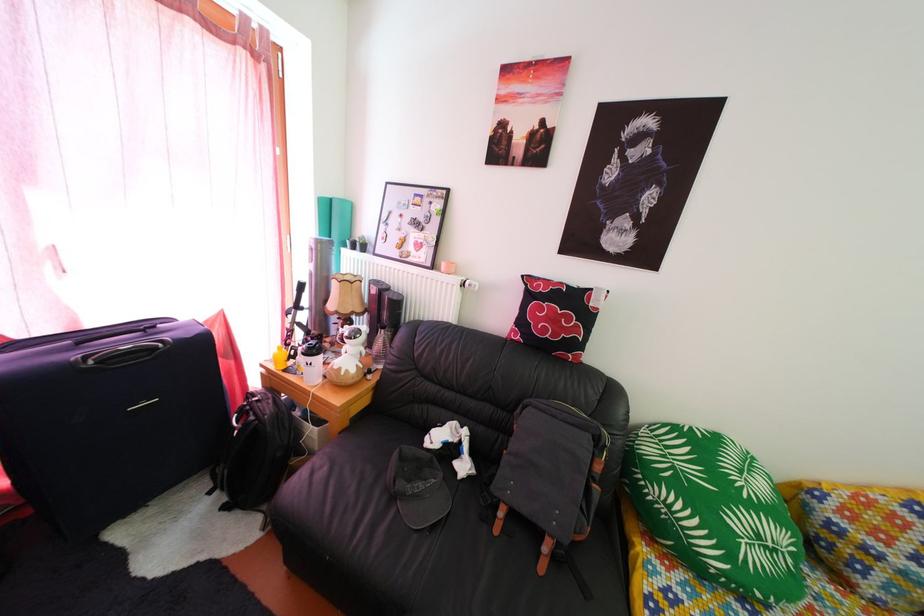
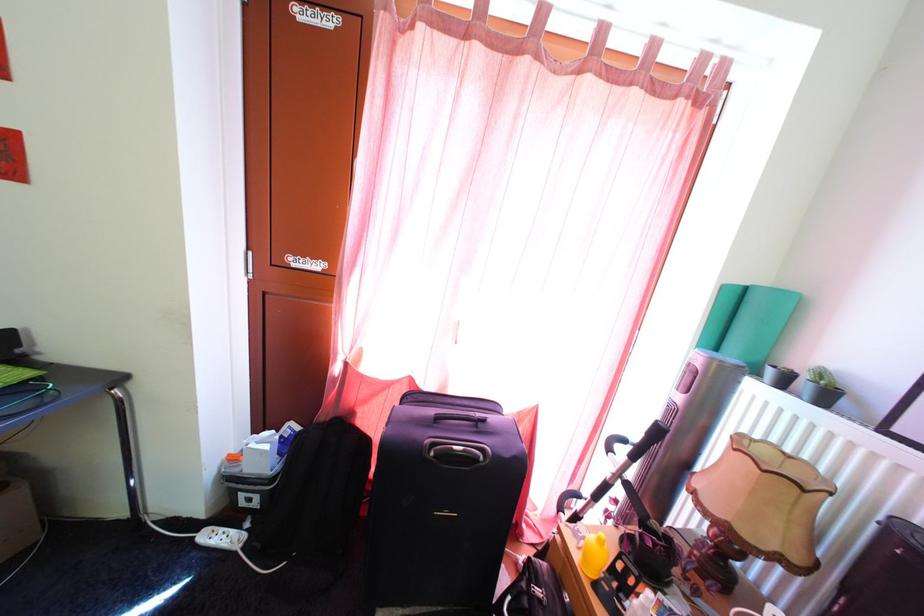
Question: Based on the continuous images, in which direction is the camera rotating? Reply with the corresponding letter.

Choices:
 (A) Left
 (B) Right
 (C) Up
 (D) Down

Answer: (A)